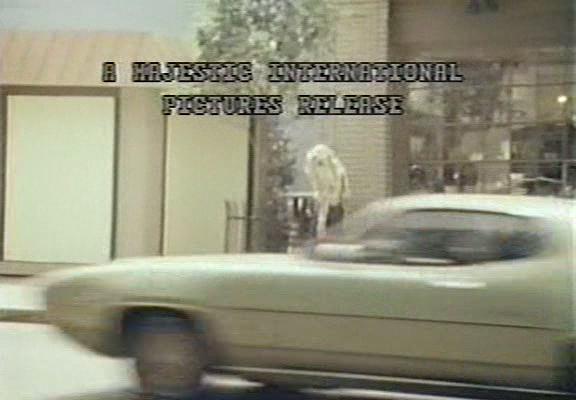
This screenshot has width=576, height=400. I want to click on window, so click(431, 229).